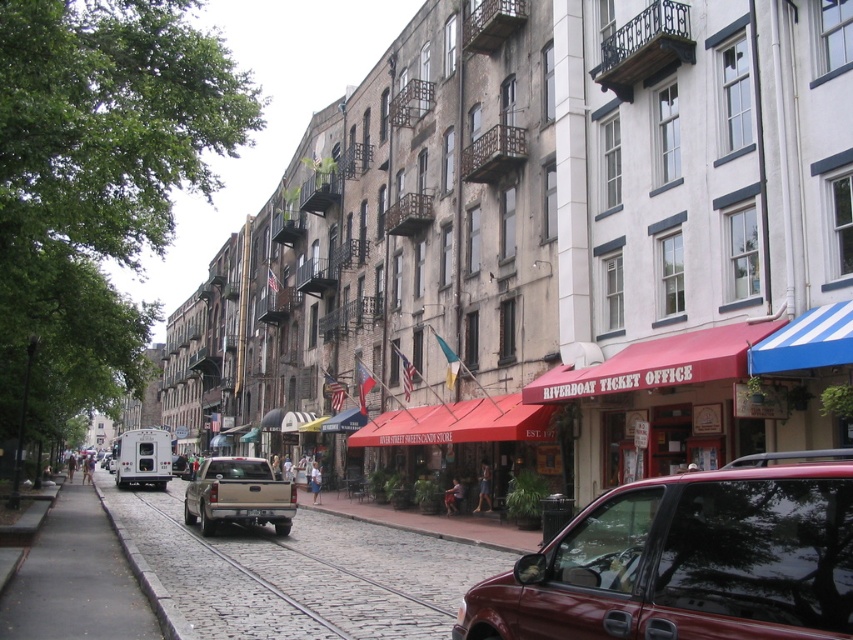
In the scene shown: Between shiny red car at lower right and cobblestone street at center, which one is positioned higher?

shiny red car at lower right

Does point (573, 528) lie behind point (416, 625)?

No, it is in front of (416, 625).

Is point (656, 573) farther from viewer compared to point (277, 572)?

No, it is in front of (277, 572).

This screenshot has width=853, height=640. I want to click on shiny red car at lower right, so click(x=686, y=563).

Does point (399, 611) lie behind point (86, 566)?

That is False.

Who is higher up, cobblestone street at center or gray cobblestone pavement at lower left?

gray cobblestone pavement at lower left is higher up.

Between point (180, 513) and point (94, 538), which one is positioned in front?

Positioned in front is point (94, 538).

Where is `cobblestone street at center`? The image size is (853, 640). cobblestone street at center is located at coordinates (302, 573).

Which is more to the left, cobblestone street at center or tan matte truck at center?

From the viewer's perspective, tan matte truck at center appears more on the left side.

What are the coordinates of `cobblestone street at center` in the screenshot? It's located at (302, 573).

Identify the location of cobblestone street at center. This screenshot has height=640, width=853. point(302,573).